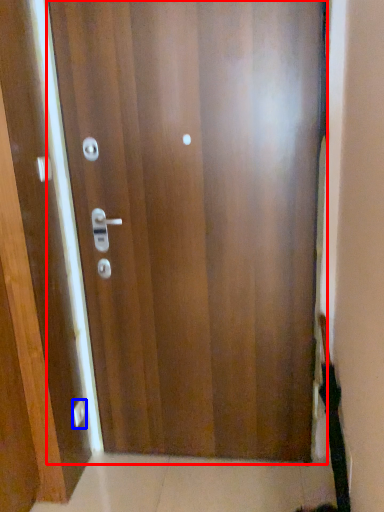
Question: Among these objects, which one is farthest to the camera, door (highlighted by a red box) or knob (highlighted by a blue box)?

Choices:
 (A) door
 (B) knob

Answer: (B)